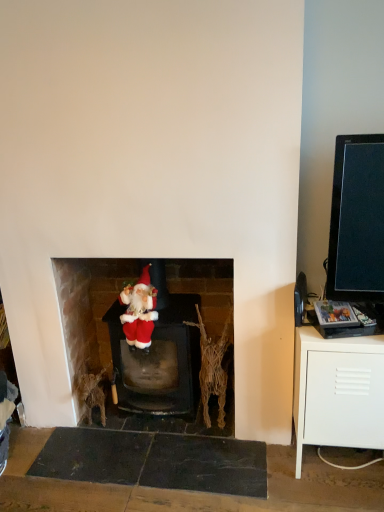
Question: Based on their sizes in the image, would you say white matte cabinet at right is bigger or smaller than fuzzy fabric santa at center?

Choices:
 (A) big
 (B) small

Answer: (A)

Question: Is white matte cabinet at right to the left or to the right of fuzzy fabric santa at center in the image?

Choices:
 (A) right
 (B) left

Answer: (A)

Question: Based on their relative distances, which object is nearer to the fuzzy fabric santa at center?

Choices:
 (A) velvet santa at center
 (B) white matte cabinet at right

Answer: (A)

Question: Estimate the real-world distances between objects in this image. Which object is farther from the white matte cabinet at right?

Choices:
 (A) fuzzy fabric santa at center
 (B) velvet santa at center

Answer: (A)